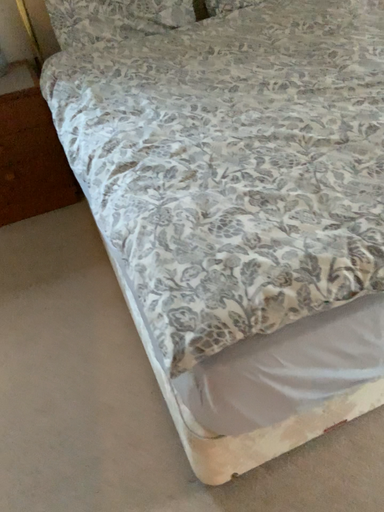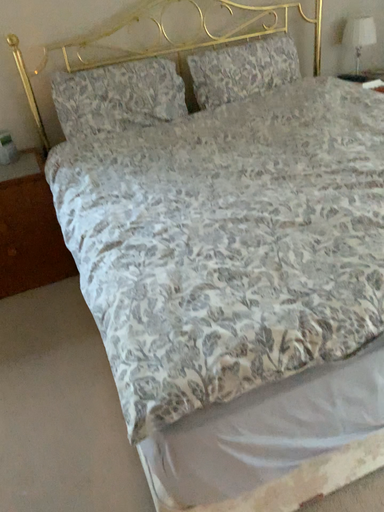
Question: How did the camera likely rotate when shooting the video?

Choices:
 (A) rotated downward
 (B) rotated upward

Answer: (B)